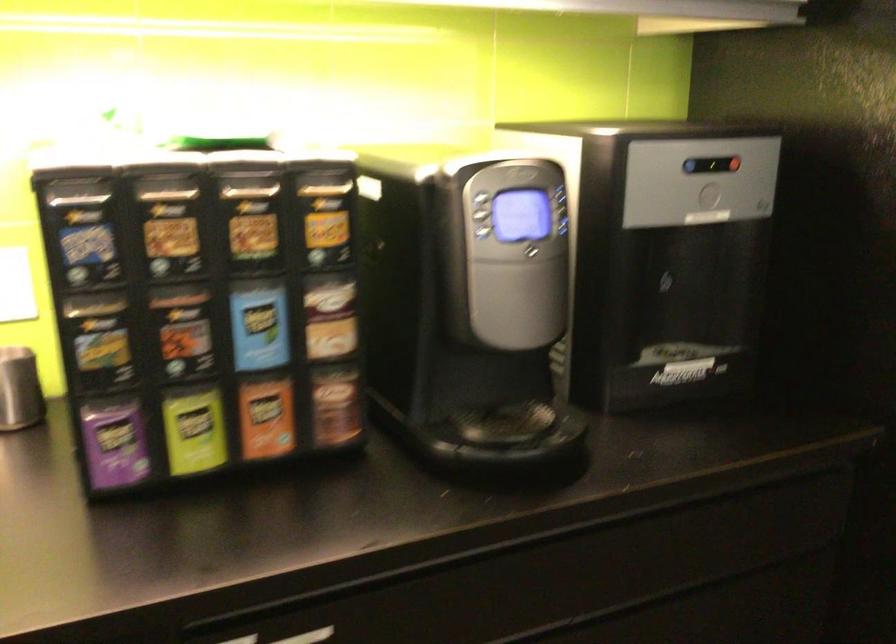
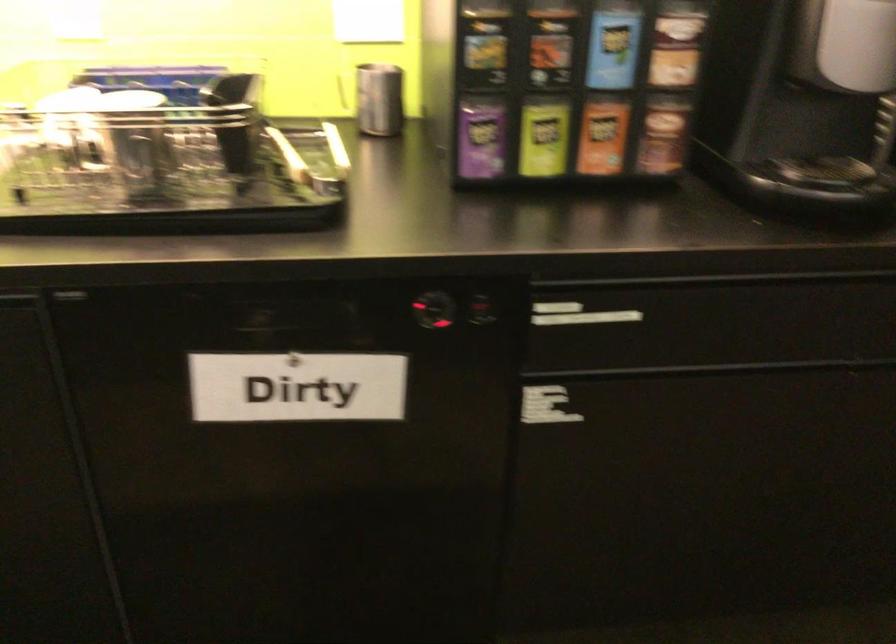
In a continuous first-person perspective shot, in which direction is the camera moving?

The cameraman walked toward left, backward.